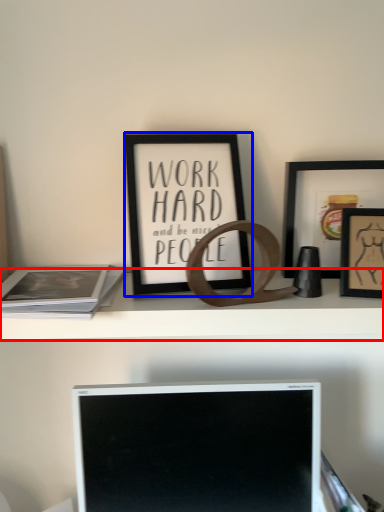
Question: Among these objects, which one is nearest to the camera, shelf (highlighted by a red box) or picture frame (highlighted by a blue box)?

Choices:
 (A) shelf
 (B) picture frame

Answer: (B)